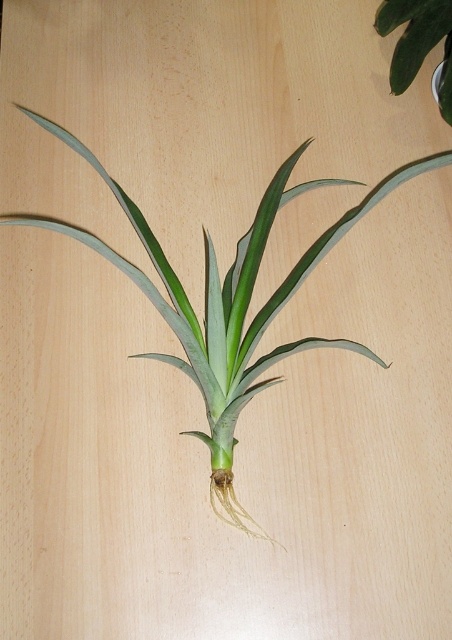
Question: Is green leafy plant at center thinner than green leafy plant at upper right?

Choices:
 (A) yes
 (B) no

Answer: (B)

Question: Does green leafy plant at center appear over green leafy plant at upper right?

Choices:
 (A) yes
 (B) no

Answer: (B)

Question: Among these points, which one is farthest from the camera?

Choices:
 (A) (398, 77)
 (B) (263, 362)

Answer: (A)

Question: Does green leafy plant at center lie in front of green leafy plant at upper right?

Choices:
 (A) yes
 (B) no

Answer: (A)

Question: Which object appears closest to the camera in this image?

Choices:
 (A) green leafy plant at center
 (B) green leafy plant at upper right

Answer: (A)